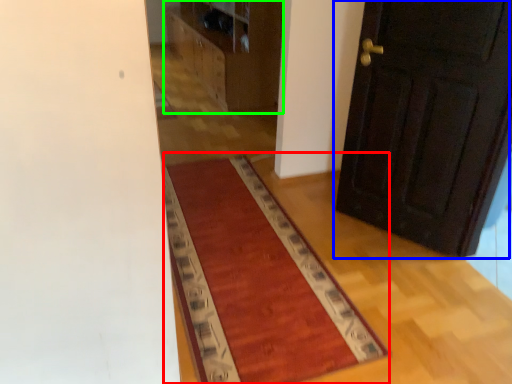
Question: Which object is the farthest from mat (highlighted by a red box)? Choose among these: door (highlighted by a blue box) or dresser (highlighted by a green box).

Choices:
 (A) door
 (B) dresser

Answer: (B)